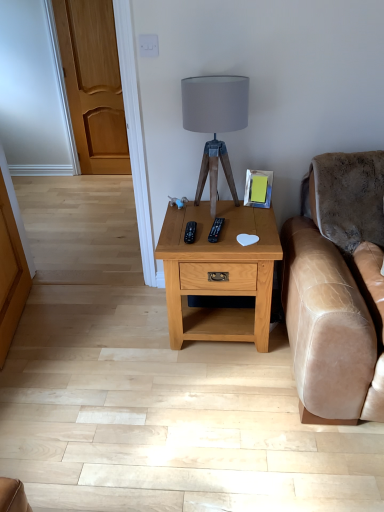
Where is `matte gray fabric lampshade at center`? The height and width of the screenshot is (512, 384). matte gray fabric lampshade at center is located at coordinates (215, 123).

Describe the element at coordinates (218, 273) in the screenshot. I see `light brown wood nightstand at center` at that location.

The width and height of the screenshot is (384, 512). What do you see at coordinates (216, 229) in the screenshot?
I see `black plastic remote at center, the 2th remote from the left` at bounding box center [216, 229].

The width and height of the screenshot is (384, 512). Find the location of `matte gray fabric lampshade at center`. matte gray fabric lampshade at center is located at coordinates pos(215,123).

Does matte gray fabric lampshade at center have a larger size compared to light brown wood nightstand at center?

No.

Is matte gray fabric lampshade at center not within light brown wood nightstand at center?

Yes, matte gray fabric lampshade at center is outside of light brown wood nightstand at center.

In order to click on nightstand behind the matte gray fabric lampshade at center in this screenshot , I will do `click(218, 273)`.

Can you tell me how much matte gray fabric lampshade at center and light brown wood nightstand at center differ in facing direction?

The facing directions of matte gray fabric lampshade at center and light brown wood nightstand at center are 0.509 degrees apart.

Between point (172, 255) and point (191, 232), which one is positioned in front?

The point (172, 255) is in front.

Is light brown wood nightstand at center taller or shorter than black plastic remote at center, acting as the first remote starting from the left?

Clearly, light brown wood nightstand at center is taller compared to black plastic remote at center, acting as the first remote starting from the left.

How different are the orientations of light brown wood nightstand at center and black plastic remote at center, acting as the first remote starting from the left, in degrees?

3.55 degrees separate the facing orientations of light brown wood nightstand at center and black plastic remote at center, acting as the first remote starting from the left.

From a real-world perspective, which object stands above the other?

black plastic remote at center, which is counted as the second remote, starting from the right.

Can you confirm if matte gray fabric lampshade at center is wider than black plastic remote at center, which is counted as the second remote, starting from the right?

Yes.

Is matte gray fabric lampshade at center oriented away from black plastic remote at center, which is counted as the second remote, starting from the right?

No, black plastic remote at center, which is counted as the second remote, starting from the right, is not at the back of matte gray fabric lampshade at center.

Is point (238, 99) farther from viewer compared to point (191, 229)?

No, (238, 99) is in front of (191, 229).

Is black plastic remote at center, which is counted as the second remote, starting from the right, further to camera compared to matte gray fabric lampshade at center?

Yes, the depth of black plastic remote at center, which is counted as the second remote, starting from the right, is greater than that of matte gray fabric lampshade at center.

From a real-world perspective, which remote is the 2nd one underneath the matte gray fabric lampshade at center? Please provide its 2D coordinates.

[(190, 232)]

From a real-world perspective, is black plastic remote at center, acting as the first remote starting from the left, physically above matte gray fabric lampshade at center?

Incorrect, from a real-world perspective, black plastic remote at center, acting as the first remote starting from the left, is lower than matte gray fabric lampshade at center.

Based on their sizes in the image, would you say black plastic remote at center, which is counted as the second remote, starting from the right, is bigger or smaller than matte gray fabric lampshade at center?

In the image, black plastic remote at center, which is counted as the second remote, starting from the right, appears to be smaller than matte gray fabric lampshade at center.

From the picture: From the image's perspective, is light brown wood nightstand at center over matte gray fabric lampshade at center?

No, from the image's perspective, light brown wood nightstand at center is not over matte gray fabric lampshade at center.

From a real-world perspective, which is physically above, light brown wood nightstand at center or matte gray fabric lampshade at center?

In real-world perspective, matte gray fabric lampshade at center is above.

Can you confirm if light brown wood nightstand at center is positioned to the left of matte gray fabric lampshade at center?

Incorrect, light brown wood nightstand at center is not on the left side of matte gray fabric lampshade at center.

Can you confirm if light brown wood nightstand at center is bigger than matte gray fabric lampshade at center?

Yes, light brown wood nightstand at center is bigger than matte gray fabric lampshade at center.

Can you confirm if black plastic remote at center, which is counted as the second remote, starting from the right, is shorter than black plastic remote at center, the 2th remote from the left?

In fact, black plastic remote at center, which is counted as the second remote, starting from the right, may be taller than black plastic remote at center, the 2th remote from the left.

Are black plastic remote at center, acting as the first remote starting from the left, and black plastic remote at center, the 1th remote in the right-to-left sequence, making contact?

Yes, black plastic remote at center, acting as the first remote starting from the left, is with black plastic remote at center, the 1th remote in the right-to-left sequence.

In the scene shown: From a real-world perspective, between black plastic remote at center, which is counted as the second remote, starting from the right, and black plastic remote at center, the 2th remote from the left, who is vertically higher?

black plastic remote at center, the 2th remote from the left, from a real-world perspective.

How different are the orientations of black plastic remote at center, the 1th remote in the right-to-left sequence, and black plastic remote at center, which is counted as the second remote, starting from the right, in degrees?

4.03 degrees.

Between point (214, 242) and point (187, 234), which one is positioned behind?

The point (187, 234) is behind.

Is black plastic remote at center, which is counted as the second remote, starting from the right, a part of black plastic remote at center, the 2th remote from the left?

Actually, black plastic remote at center, which is counted as the second remote, starting from the right, is outside black plastic remote at center, the 2th remote from the left.

Is black plastic remote at center, the 2th remote from the left, not near black plastic remote at center, which is counted as the second remote, starting from the right?

No, black plastic remote at center, the 2th remote from the left, is not far away from black plastic remote at center, which is counted as the second remote, starting from the right.

This screenshot has width=384, height=512. Find the location of `nightstand lying below the matte gray fabric lampshade at center (from the image's perspective)`. nightstand lying below the matte gray fabric lampshade at center (from the image's perspective) is located at coordinates (218, 273).

Image resolution: width=384 pixels, height=512 pixels. Identify the location of nightstand in front of the black plastic remote at center, acting as the first remote starting from the left. (218, 273).

Considering their positions, is matte gray fabric lampshade at center positioned further to black plastic remote at center, the 2th remote from the left, than black plastic remote at center, which is counted as the second remote, starting from the right?

The object further to black plastic remote at center, the 2th remote from the left, is matte gray fabric lampshade at center.

Based on their spatial positions, is matte gray fabric lampshade at center or black plastic remote at center, the 2th remote from the left, closer to light brown wood nightstand at center?

black plastic remote at center, the 2th remote from the left, is positioned closer to the anchor light brown wood nightstand at center.

Considering their positions, is matte gray fabric lampshade at center positioned closer to black plastic remote at center, the 2th remote from the left, than light brown wood nightstand at center?

Among the two, light brown wood nightstand at center is located nearer to black plastic remote at center, the 2th remote from the left.

From the image, which object appears to be nearer to black plastic remote at center, which is counted as the second remote, starting from the right, black plastic remote at center, the 1th remote in the right-to-left sequence, or matte gray fabric lampshade at center?

black plastic remote at center, the 1th remote in the right-to-left sequence, is closer to black plastic remote at center, which is counted as the second remote, starting from the right.

Estimate the real-world distances between objects in this image. Which object is closer to light brown wood nightstand at center, black plastic remote at center, the 1th remote in the right-to-left sequence, or matte gray fabric lampshade at center?

black plastic remote at center, the 1th remote in the right-to-left sequence, lies closer to light brown wood nightstand at center than the other object.

Which object lies nearer to the anchor point matte gray fabric lampshade at center, black plastic remote at center, acting as the first remote starting from the left, or black plastic remote at center, the 2th remote from the left?

black plastic remote at center, the 2th remote from the left, is positioned closer to the anchor matte gray fabric lampshade at center.

When comparing their distances from light brown wood nightstand at center, does black plastic remote at center, the 2th remote from the left, or black plastic remote at center, which is counted as the second remote, starting from the right, seem further?

Among the two, black plastic remote at center, which is counted as the second remote, starting from the right, is located further to light brown wood nightstand at center.

When comparing their distances from black plastic remote at center, the 1th remote in the right-to-left sequence, does black plastic remote at center, acting as the first remote starting from the left, or light brown wood nightstand at center seem closer?

black plastic remote at center, acting as the first remote starting from the left.

What are the coordinates of `remote that lies between black plastic remote at center, the 1th remote in the right-to-left sequence, and light brown wood nightstand at center from top to bottom` in the screenshot? It's located at (190, 232).

The image size is (384, 512). Find the location of `remote between matte gray fabric lampshade at center and black plastic remote at center, which is counted as the second remote, starting from the right, vertically`. remote between matte gray fabric lampshade at center and black plastic remote at center, which is counted as the second remote, starting from the right, vertically is located at coordinates (216, 229).